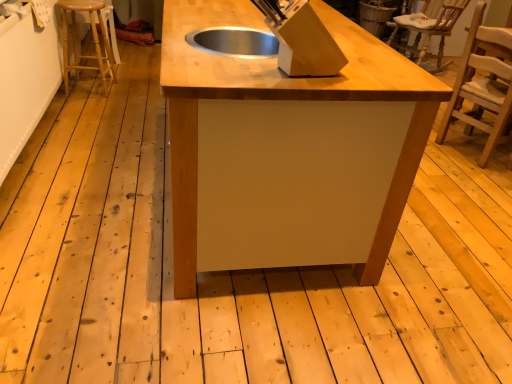
Where is `wooden chair at upper right, which is the 2th chair from front to back`? The width and height of the screenshot is (512, 384). wooden chair at upper right, which is the 2th chair from front to back is located at coordinates pyautogui.click(x=429, y=27).

Describe the element at coordinates (429, 27) in the screenshot. This screenshot has width=512, height=384. I see `wooden chair at upper right, which is the 1th chair in top-to-bottom order` at that location.

This screenshot has width=512, height=384. What do you see at coordinates (79, 39) in the screenshot? I see `light brown wooden stool at left` at bounding box center [79, 39].

At what (x,y) coordinates should I click in order to perform the action: click on light brown wooden stool at left. Please return your answer as a coordinate pair (x, y). This screenshot has width=512, height=384. Looking at the image, I should click on (79, 39).

You are a GUI agent. You are given a task and a screenshot of the screen. Output one action in this format:
    pyautogui.click(x=<x>, y=<y>)
    Task: Click on the wooden chair at upper right, which is counted as the first chair, starting from the back
    The image size is (512, 384).
    Given the screenshot: What is the action you would take?
    pyautogui.click(x=429, y=27)

What's the angular difference between matte wood table at center and light brown wooden chair at right, placed as the first chair when sorted from bottom to top,'s facing directions?

There is a 20.7-degree angle between the facing directions of matte wood table at center and light brown wooden chair at right, placed as the first chair when sorted from bottom to top.

From the image's perspective, which one is positioned lower, matte wood table at center or light brown wooden chair at right, marked as the 2th chair in a back-to-front arrangement?

matte wood table at center.

Is matte wood table at center turned away from light brown wooden chair at right, which ranks as the first chair in front-to-back order?

No, light brown wooden chair at right, which ranks as the first chair in front-to-back order, is not at the back of matte wood table at center.

The image size is (512, 384). Find the location of `table below the light brown wooden chair at right, marked as the 2th chair in a back-to-front arrangement (from a real-world perspective)`. table below the light brown wooden chair at right, marked as the 2th chair in a back-to-front arrangement (from a real-world perspective) is located at coordinates (288, 145).

Is matte wood table at center beside wooden chair at upper right, which is the 2th chair from front to back?

No, matte wood table at center is not beside wooden chair at upper right, which is the 2th chair from front to back.

Looking at this image, which of these two, matte wood table at center or wooden chair at upper right, which is the 2th chair from front to back, stands taller?

matte wood table at center is taller.

Choose the correct answer: Is matte wood table at center inside wooden chair at upper right, which is the 2th chair from front to back, or outside it?

The correct answer is: outside.

In the scene shown: Is matte wood table at center looking in the opposite direction of wooden chair at upper right, which is the 2th chair from front to back?

matte wood table at center is not turned away from wooden chair at upper right, which is the 2th chair from front to back.

Find the location of a particular element. The width and height of the screenshot is (512, 384). chair below the light brown wooden chair at right, which is counted as the 2th chair, starting from the top (from a real-world perspective) is located at coordinates (429, 27).

From the image's perspective, between wooden chair at upper right, the 2th chair when ordered from bottom to top, and light brown wooden chair at right, which ranks as the first chair in front-to-back order, which one is located above?

wooden chair at upper right, the 2th chair when ordered from bottom to top, from the image's perspective.

Which is closer to the camera, (417, 21) or (511, 77)?

The point (511, 77) is closer.

From the picture: Is wooden chair at upper right, which is the 1th chair in top-to-bottom order, wider or thinner than light brown wooden chair at right, which ranks as the first chair in front-to-back order?

Clearly, wooden chair at upper right, which is the 1th chair in top-to-bottom order, has more width compared to light brown wooden chair at right, which ranks as the first chair in front-to-back order.

From a real-world perspective, between wooden chair at upper right, the 2th chair when ordered from bottom to top, and light brown wooden stool at left, who is vertically lower?

light brown wooden stool at left, from a real-world perspective.

Considering the sizes of objects wooden chair at upper right, which is counted as the first chair, starting from the back, and light brown wooden stool at left in the image provided, who is bigger, wooden chair at upper right, which is counted as the first chair, starting from the back, or light brown wooden stool at left?

wooden chair at upper right, which is counted as the first chair, starting from the back, is bigger.

From the image's perspective, relative to light brown wooden stool at left, is wooden chair at upper right, which is the 1th chair in top-to-bottom order, above or below?

wooden chair at upper right, which is the 1th chair in top-to-bottom order, is above light brown wooden stool at left.

Measure the distance from wooden chair at upper right, which is the 2th chair from front to back, to light brown wooden stool at left.

A distance of 7.86 feet exists between wooden chair at upper right, which is the 2th chair from front to back, and light brown wooden stool at left.

Can you confirm if light brown wooden chair at right, placed as the first chair when sorted from bottom to top, is positioned to the left of matte wood table at center?

Incorrect, light brown wooden chair at right, placed as the first chair when sorted from bottom to top, is not on the left side of matte wood table at center.

Find the location of a particular element. This screenshot has height=384, width=512. table below the light brown wooden chair at right, which ranks as the first chair in front-to-back order (from the image's perspective) is located at coordinates (288, 145).

Which is closer, (459, 114) or (419, 84)?

Point (459, 114).

Which of these two, light brown wooden stool at left or matte wood table at center, is bigger?

With larger size is matte wood table at center.

Considering the relative sizes of light brown wooden stool at left and matte wood table at center in the image provided, is light brown wooden stool at left taller than matte wood table at center?

No, light brown wooden stool at left is not taller than matte wood table at center.

Considering the sizes of objects light brown wooden stool at left and matte wood table at center in the image provided, who is thinner, light brown wooden stool at left or matte wood table at center?

With smaller width is light brown wooden stool at left.

Is point (72, 29) in front of point (180, 232)?

No, it is behind (180, 232).

Does light brown wooden stool at left have a greater height compared to wooden chair at upper right, the 2th chair when ordered from bottom to top?

No.

Is light brown wooden stool at left turned away from wooden chair at upper right, which is the 2th chair from front to back?

That's not correct — light brown wooden stool at left is not looking away from wooden chair at upper right, which is the 2th chair from front to back.

How far apart are light brown wooden stool at left and wooden chair at upper right, the 2th chair when ordered from bottom to top?

The distance of light brown wooden stool at left from wooden chair at upper right, the 2th chair when ordered from bottom to top, is 7.86 feet.

Identify the location of chair that is the 2nd one when counting rightward from the light brown wooden stool at left. The height and width of the screenshot is (384, 512). (429, 27).

The image size is (512, 384). In order to click on chair above the matte wood table at center (from a real-world perspective) in this screenshot , I will do `click(483, 85)`.

I want to click on table lying on the left of wooden chair at upper right, which is counted as the first chair, starting from the back, so click(x=288, y=145).

Based on their spatial positions, is light brown wooden chair at right, which ranks as the first chair in front-to-back order, or wooden chair at upper right, the 2th chair when ordered from bottom to top, closer to light brown wooden stool at left?

wooden chair at upper right, the 2th chair when ordered from bottom to top, is closer to light brown wooden stool at left.

Looking at the image, which one is located closer to wooden chair at upper right, which is the 1th chair in top-to-bottom order, light brown wooden chair at right, which ranks as the first chair in front-to-back order, or light brown wooden stool at left?

light brown wooden chair at right, which ranks as the first chair in front-to-back order, lies closer to wooden chair at upper right, which is the 1th chair in top-to-bottom order, than the other object.

From the image, which object appears to be nearer to wooden chair at upper right, which is the 1th chair in top-to-bottom order, light brown wooden stool at left or matte wood table at center?

matte wood table at center lies closer to wooden chair at upper right, which is the 1th chair in top-to-bottom order, than the other object.

Based on the photo, which object lies nearer to the anchor point light brown wooden chair at right, which is counted as the 2th chair, starting from the top, light brown wooden stool at left or matte wood table at center?

matte wood table at center.

When comparing their distances from light brown wooden stool at left, does matte wood table at center or light brown wooden chair at right, which is counted as the 2th chair, starting from the top, seem closer?

matte wood table at center is positioned closer to the anchor light brown wooden stool at left.

Looking at the image, which one is located further to matte wood table at center, light brown wooden chair at right, placed as the first chair when sorted from bottom to top, or wooden chair at upper right, which is counted as the first chair, starting from the back?

Among the two, light brown wooden chair at right, placed as the first chair when sorted from bottom to top, is located further to matte wood table at center.

Looking at this image, looking at the image, which one is located further to light brown wooden stool at left, wooden chair at upper right, which is counted as the first chair, starting from the back, or matte wood table at center?

wooden chair at upper right, which is counted as the first chair, starting from the back.

Based on their spatial positions, is matte wood table at center or wooden chair at upper right, which is the 1th chair in top-to-bottom order, further from light brown wooden stool at left?

wooden chair at upper right, which is the 1th chair in top-to-bottom order.

I want to click on chair located between matte wood table at center and wooden chair at upper right, which is counted as the first chair, starting from the back, in the depth direction, so click(x=483, y=85).

Image resolution: width=512 pixels, height=384 pixels. Identify the location of table located between light brown wooden stool at left and light brown wooden chair at right, which ranks as the first chair in front-to-back order, in the left-right direction. (288, 145).

Identify the location of chair between light brown wooden stool at left and wooden chair at upper right, the 2th chair when ordered from bottom to top. The image size is (512, 384). (483, 85).

You are a GUI agent. You are given a task and a screenshot of the screen. Output one action in this format:
    pyautogui.click(x=<x>, y=<y>)
    Task: Click on the table situated between light brown wooden stool at left and wooden chair at upper right, which is the 2th chair from front to back, from left to right
    This screenshot has height=384, width=512.
    Given the screenshot: What is the action you would take?
    pyautogui.click(x=288, y=145)